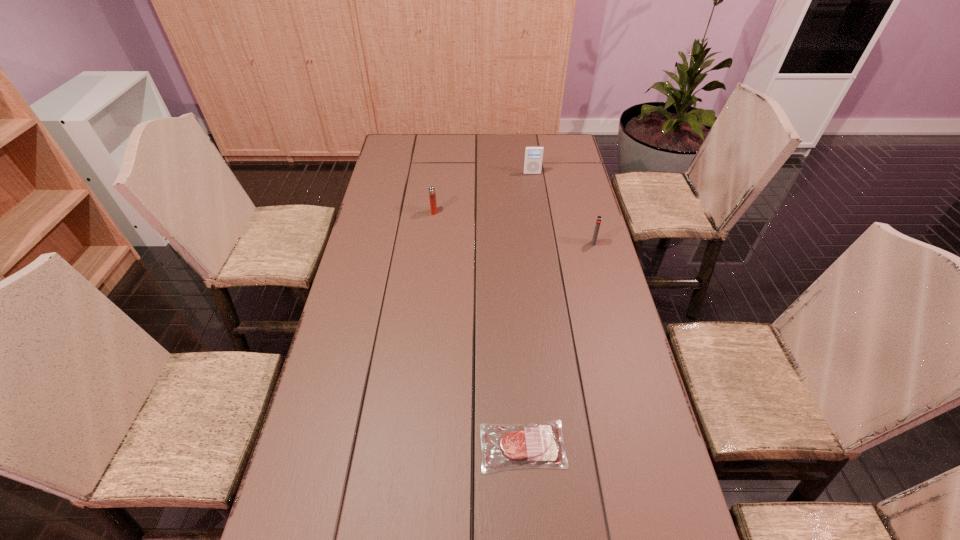
I want to click on free space that satisfies the following two spatial constraints: 1. on the front-facing side of the rightmost object; 2. on the left side of the farthest object, so click(542, 243).